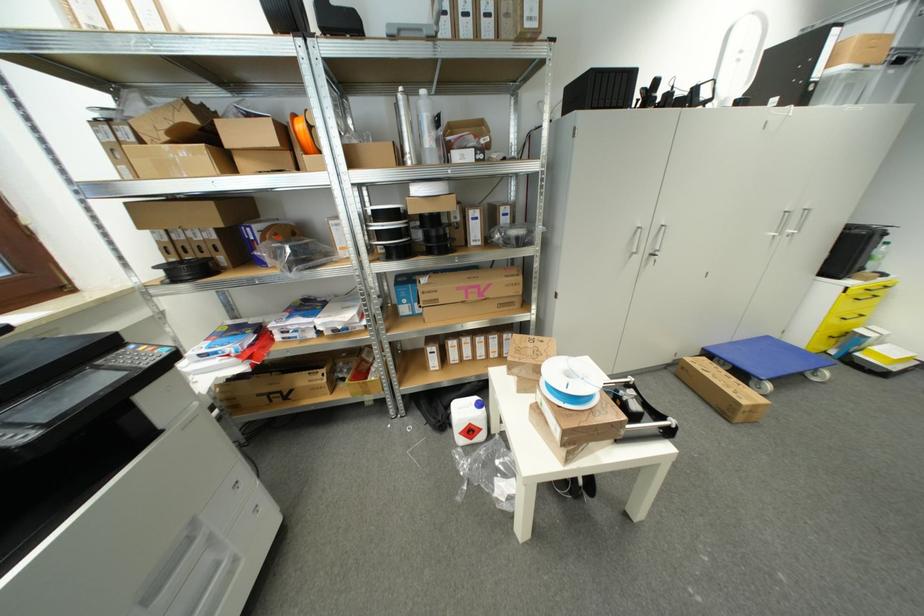
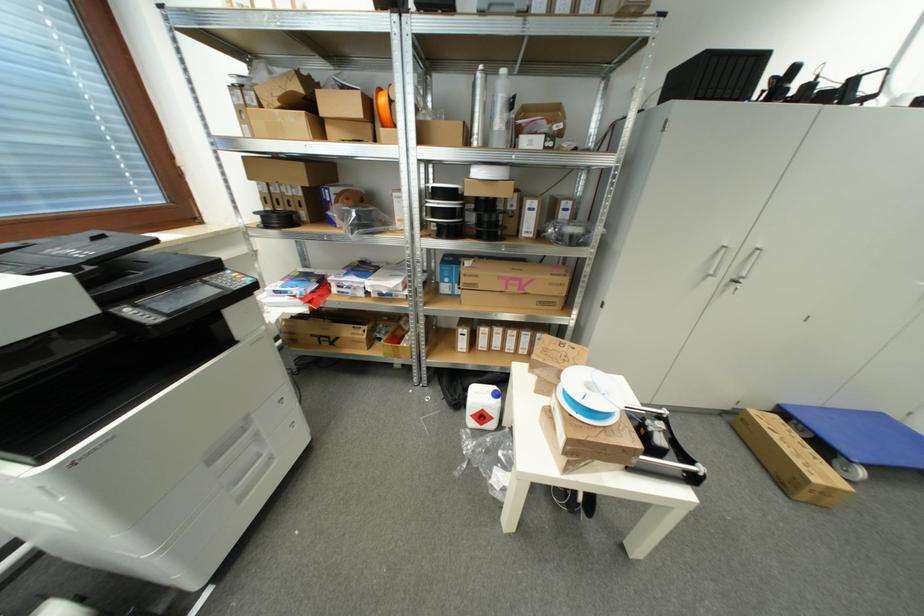
Where in the second image is the point corresponding to pixel 478 300 from the first image?

(517, 292)